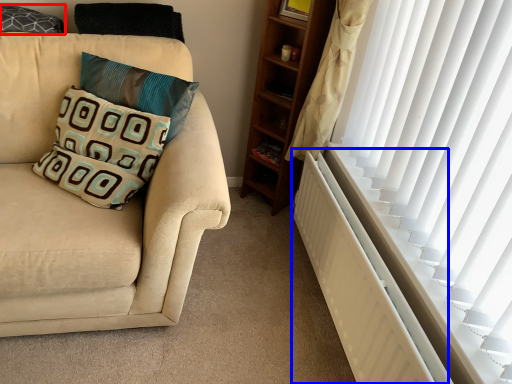
Question: Which object is closer to the camera taking this photo, pillow (highlighted by a red box) or radiator (highlighted by a blue box)?

Choices:
 (A) pillow
 (B) radiator

Answer: (B)